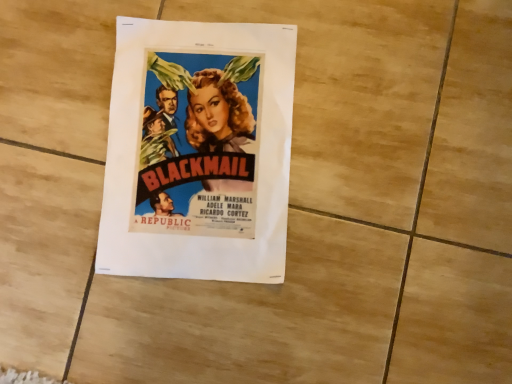
This screenshot has width=512, height=384. Describe the element at coordinates (198, 151) in the screenshot. I see `matte paper poster at center` at that location.

Measure the distance between point (x=262, y=247) and camera.

The distance of point (x=262, y=247) from camera is 18.31 inches.

The image size is (512, 384). I want to click on matte paper poster at center, so click(x=198, y=151).

Where is `matte paper poster at center`? Image resolution: width=512 pixels, height=384 pixels. matte paper poster at center is located at coordinates (198, 151).